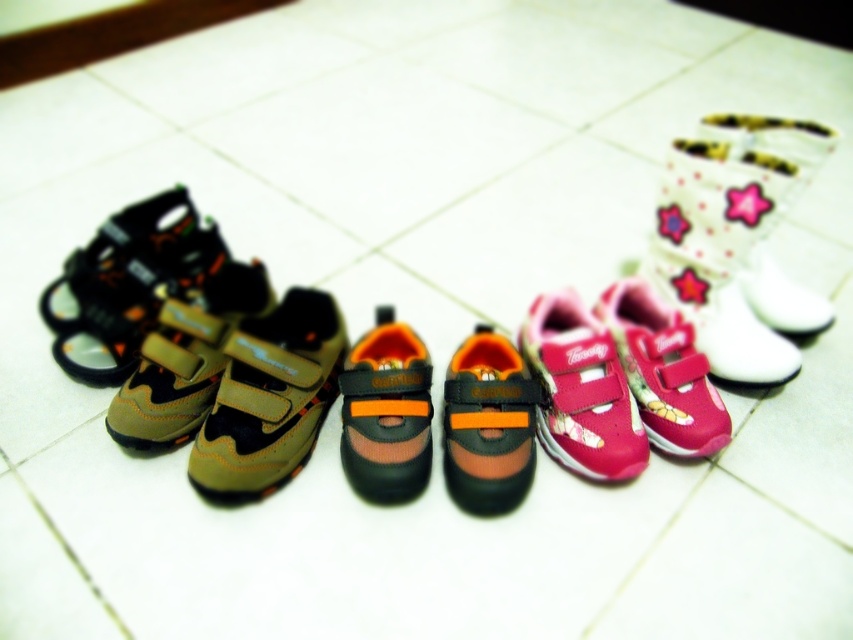
You are helping organize children shoes in a store. You have two shoes to place on a shelf that can only hold items where the smaller one is in front. The shoes are the matte khaki shoe at center and the orange mesh shoe at center. Which shoe should you place in front?

The matte khaki shoe at center is smaller than the orange mesh shoe at center, so you should place the matte khaki shoe at center in front to follow the shelf arrangement rule.

You are a parent trying to organize your childen s shoes. You have a brown suede sandal at left and an orange fabric shoe at center. You need to place a new pair of shoes between them. Is there enough space for the new pair if each shoe is 10 inches wide?

The brown suede sandal at left is 17.98 inches away from the orange fabric shoe at center. Since the distance between them is greater than 10 inches, there is enough space to place the new pair of shoes between them.

You are standing at the entrance of the room and see the arrangement of children shoes. The pink fabric shoe at upper right is represented by point (x=772, y=141). Which direction should you move to reach the pink fabric shoe at upper right?

The pink fabric shoe at upper right is located at point (x=772, y=141), so you should move towards the upper right direction to reach it.